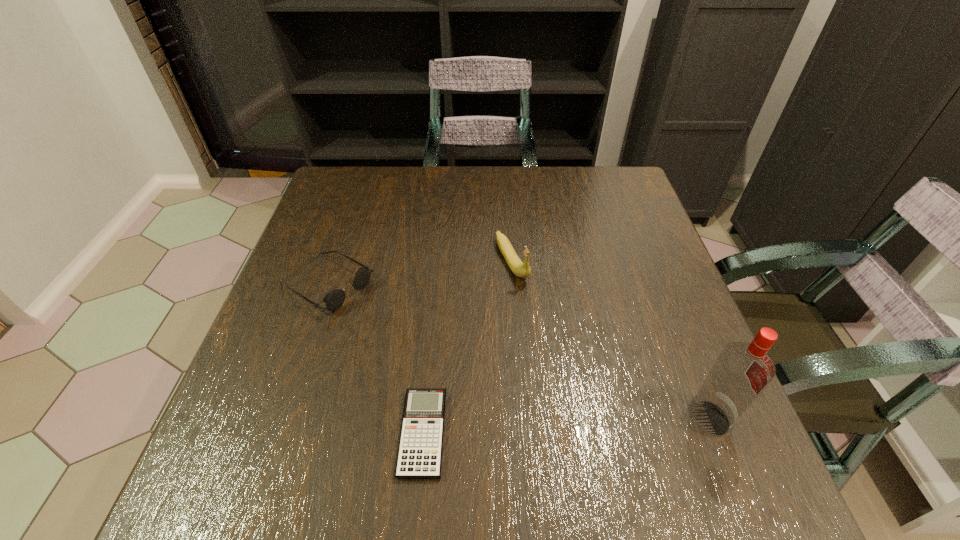
In the image, there is a desktop. Where is `free space at the far edge`? This screenshot has height=540, width=960. free space at the far edge is located at coordinates (393, 204).

Find the location of a particular element. free space at the near edge of the desktop is located at coordinates (620, 408).

Identify the location of vacant area at the left edge. (356, 254).

Identify the location of vacant space at the right edge of the desktop. (668, 314).

Image resolution: width=960 pixels, height=540 pixels. What are the coordinates of `vacant space at the far right corner of the desktop` in the screenshot? It's located at [579, 178].

Locate an element on the screen. The width and height of the screenshot is (960, 540). empty space between the sunglasses and the rightmost object is located at coordinates (518, 352).

Find the location of a particular element. The image size is (960, 540). unoccupied area between the shortest object and the second tallest object is located at coordinates (468, 347).

You are a GUI agent. You are given a task and a screenshot of the screen. Output one action in this format:
    pyautogui.click(x=<x>, y=<y>)
    Task: Click on the vacant space in between the shortest object and the sunglasses
    
    Given the screenshot: What is the action you would take?
    pyautogui.click(x=375, y=359)

In order to click on empty space between the rightmost object and the second object from left to right in this screenshot , I will do `click(565, 426)`.

Identify the location of empty space that is in between the rightmost object and the sunglasses. (518, 352).